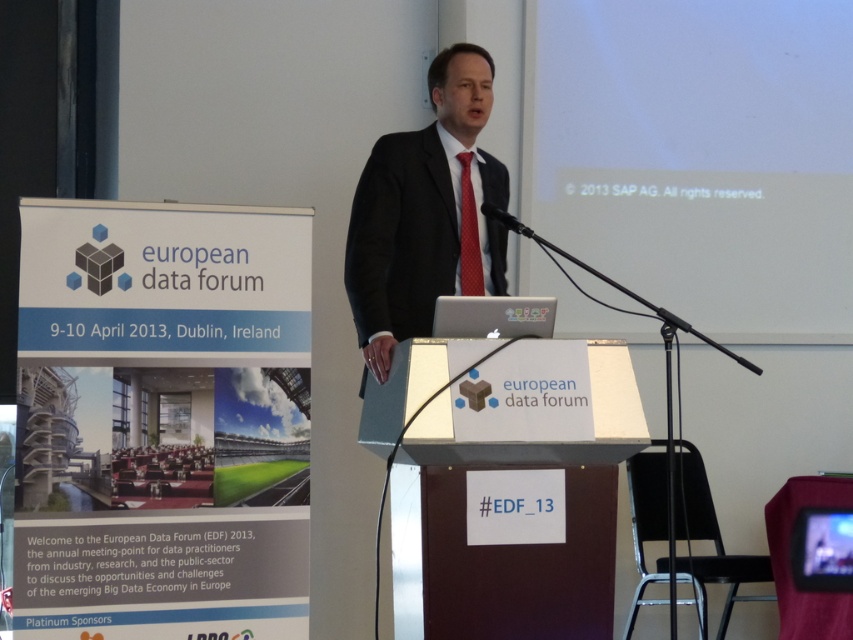
Question: Considering the relative positions of white matte projection screen at upper right and red dotted tie at center in the image provided, where is white matte projection screen at upper right located with respect to red dotted tie at center?

Choices:
 (A) below
 (B) above

Answer: (B)

Question: Can you confirm if white plastic podium at center is bigger than red dotted tie at center?

Choices:
 (A) yes
 (B) no

Answer: (A)

Question: Which point is closer to the camera?

Choices:
 (A) matte black suit at center
 (B) red dotted tie at center

Answer: (A)

Question: Estimate the real-world distances between objects in this image. Which object is farther from the matte black suit at center?

Choices:
 (A) red dotted tie at center
 (B) white plastic podium at center

Answer: (B)

Question: Which object is farther from the camera taking this photo?

Choices:
 (A) white matte projection screen at upper right
 (B) matte black suit at center
 (C) red dotted tie at center

Answer: (A)

Question: From the image, what is the correct spatial relationship of matte black suit at center in relation to white plastic podium at center?

Choices:
 (A) left
 (B) right

Answer: (A)